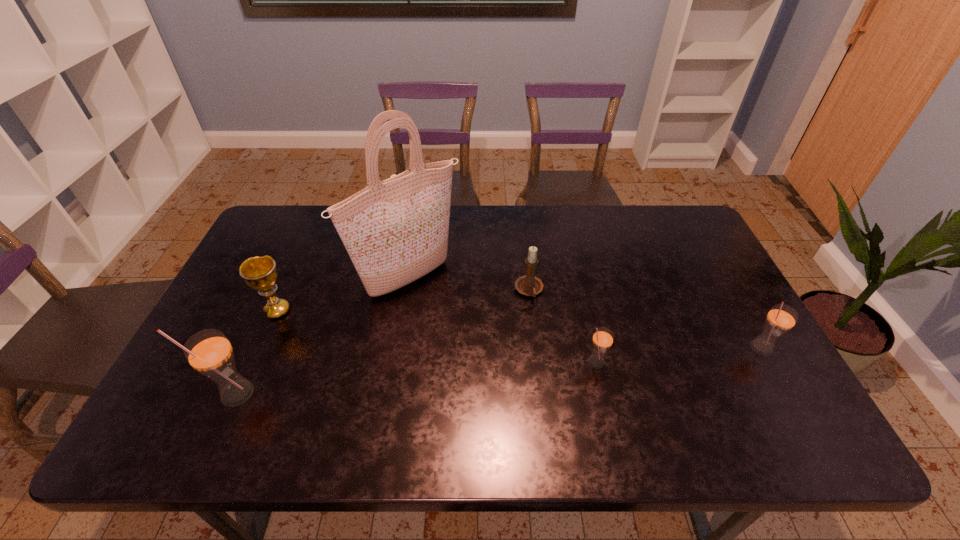
You are a GUI agent. You are given a task and a screenshot of the screen. Output one action in this format:
    pyautogui.click(x=<x>, y=<y>)
    Task: Click on the vacant region located 0.050m on the back of the nearest straw
    The width and height of the screenshot is (960, 540).
    Given the screenshot: What is the action you would take?
    pyautogui.click(x=251, y=361)

The width and height of the screenshot is (960, 540). Find the location of `vacant region located 0.160m on the left of the shortest straw`. vacant region located 0.160m on the left of the shortest straw is located at coordinates point(521,362).

Identify the location of free spot located on the left of the rightmost object. (669, 348).

Where is `blank space located on the side of the candle holder with the handle`? The width and height of the screenshot is (960, 540). blank space located on the side of the candle holder with the handle is located at coordinates (541, 395).

This screenshot has width=960, height=540. What are the coordinates of `free space located on the left of the chalice` in the screenshot? It's located at (233, 310).

The width and height of the screenshot is (960, 540). I want to click on free spot located 0.180m on the back of the fourth object from right to left, so click(x=420, y=219).

Where is `object that is at the near edge`? object that is at the near edge is located at coordinates (209, 352).

Locate an element on the screen. The height and width of the screenshot is (540, 960). straw present at the left edge is located at coordinates (209, 352).

Find the location of a particular element. The image size is (960, 540). chalice that is positioned at the left edge is located at coordinates (260, 273).

Identify the location of object situated at the right edge. The width and height of the screenshot is (960, 540). (781, 318).